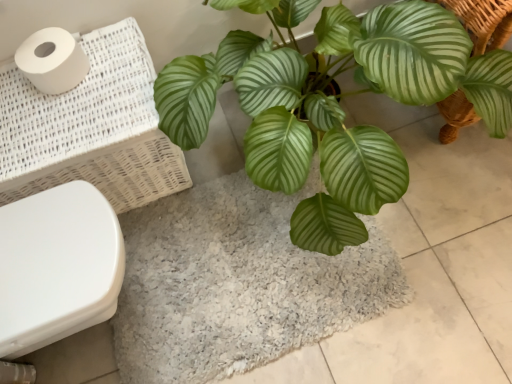
Identify the location of free space above gray shaggy bath mat at center (from a real-world perspective). Image resolution: width=512 pixels, height=384 pixels. (220, 272).